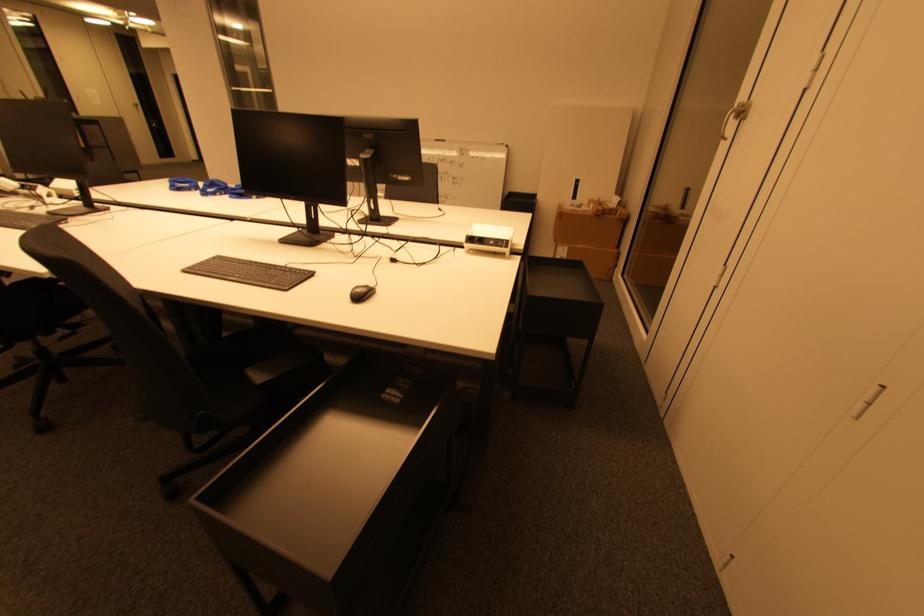
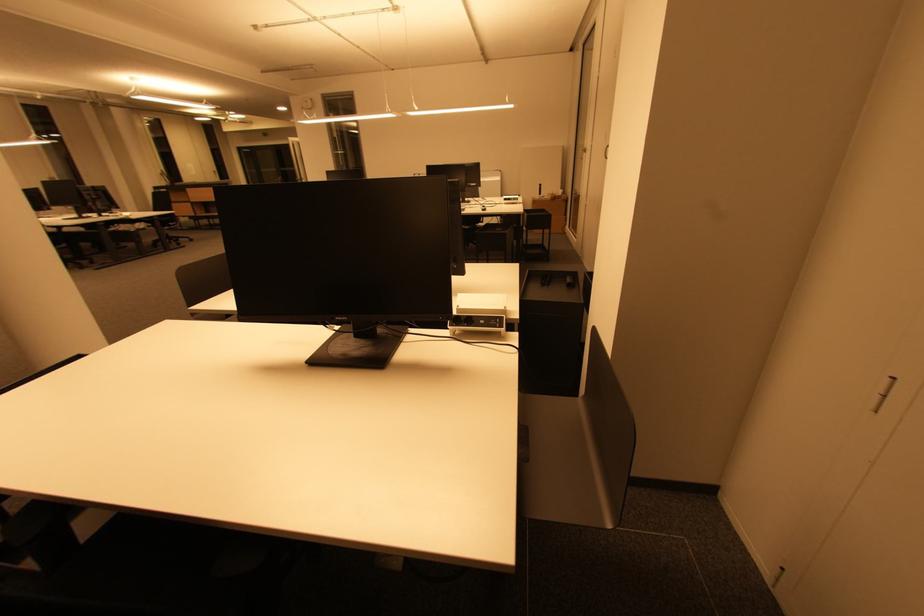
Question: The images are taken continuously from a first-person perspective. In which direction are you moving?

Choices:
 (A) Left
 (B) Right
 (C) Forward
 (D) Backward

Answer: (D)